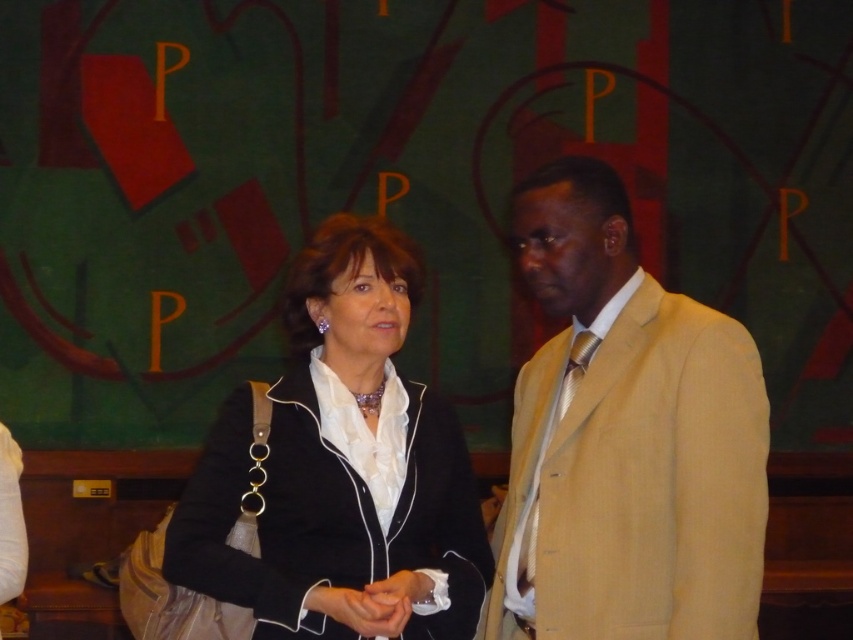
You are a fashion designer observing the two individuals in the image. You need to determine which clothing item would be more suitable for a tight, narrow hallway. The two items are the tan textured suit at center and the black satin blazer at center. Which one is recommended?

The tan textured suit at center is thinner than the black satin blazer at center, so it would be more suitable for a tight, narrow hallway as it takes up less space.

You are a photographer adjusting your camera to focus on two specific points in the image. The points are labeled as point 1 at coordinates point (561, 296) and point 2 at coordinates point (426, 483). Which point should you focus on first if you want to capture both points in sharp focus without moving the camera?

Point 1 at coordinates point (561, 296) is closer to the camera than point 2 at coordinates point (426, 483). To capture both points in sharp focus without moving the camera, you should focus on the closer point first, which is point (561, 296).

You are a fashion designer observing two outfits displayed in the center of the image. The tan textured suit at center and the black satin blazer at center. Which one is bigger in size?

The tan textured suit at center is larger in size compared to the black satin blazer at center.